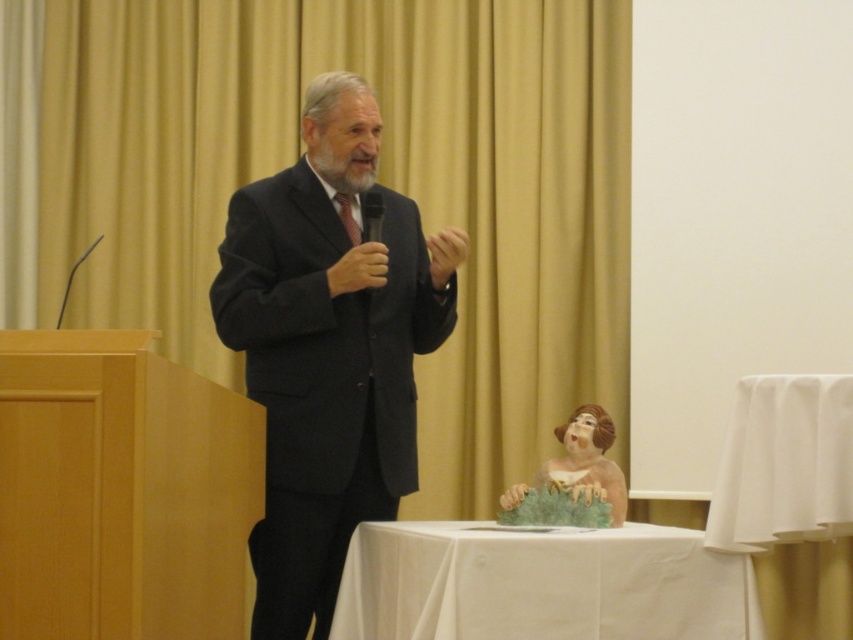
Question: Can you confirm if matte yellow curtain at upper center is positioned below black plastic microphone at center?

Choices:
 (A) no
 (B) yes

Answer: (A)

Question: Which point is farther from the camera taking this photo?

Choices:
 (A) (416, 289)
 (B) (379, 205)

Answer: (A)

Question: Which object is farther from the camera taking this photo?

Choices:
 (A) white cloth at lower center
 (B) metallic wire at left

Answer: (A)

Question: Does white cloth at lower center have a lesser width compared to white cloth at right?

Choices:
 (A) no
 (B) yes

Answer: (A)

Question: Considering the real-world distances, which object is closest to the white cloth at lower center?

Choices:
 (A) matte yellow curtain at upper center
 (B) dark gray suit at center

Answer: (B)

Question: Is matte yellow curtain at upper center further to camera compared to white cloth at right?

Choices:
 (A) no
 (B) yes

Answer: (B)